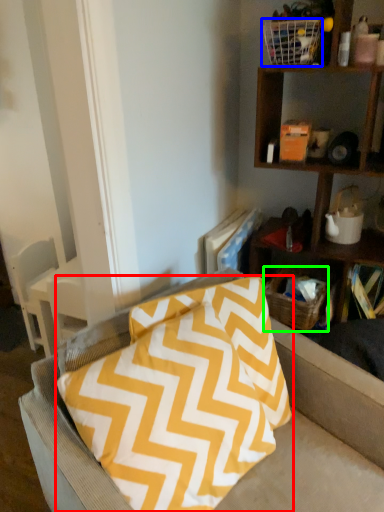
Question: Considering the real-world distances, which object is closest to pillow (highlighted by a red box)? basket (highlighted by a blue box) or basket (highlighted by a green box).

Choices:
 (A) basket
 (B) basket

Answer: (B)